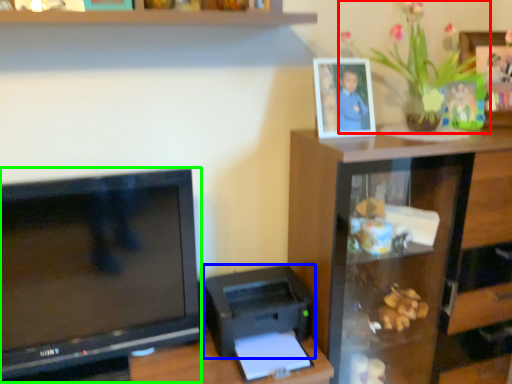
Question: Estimate the real-world distances between objects in this image. Which object is farther from houseplant (highlighted by a red box), printer (highlighted by a blue box) or television (highlighted by a green box)?

Choices:
 (A) printer
 (B) television

Answer: (B)